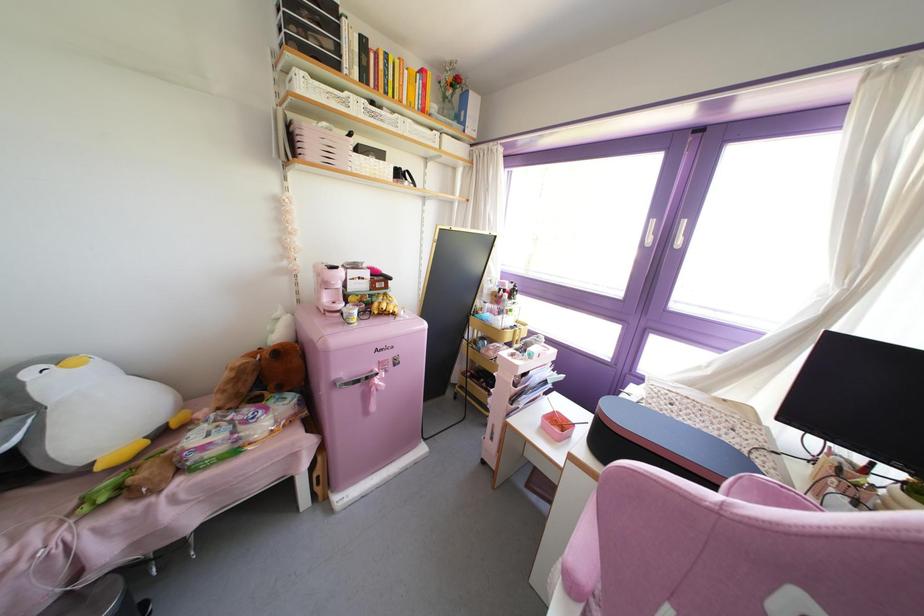
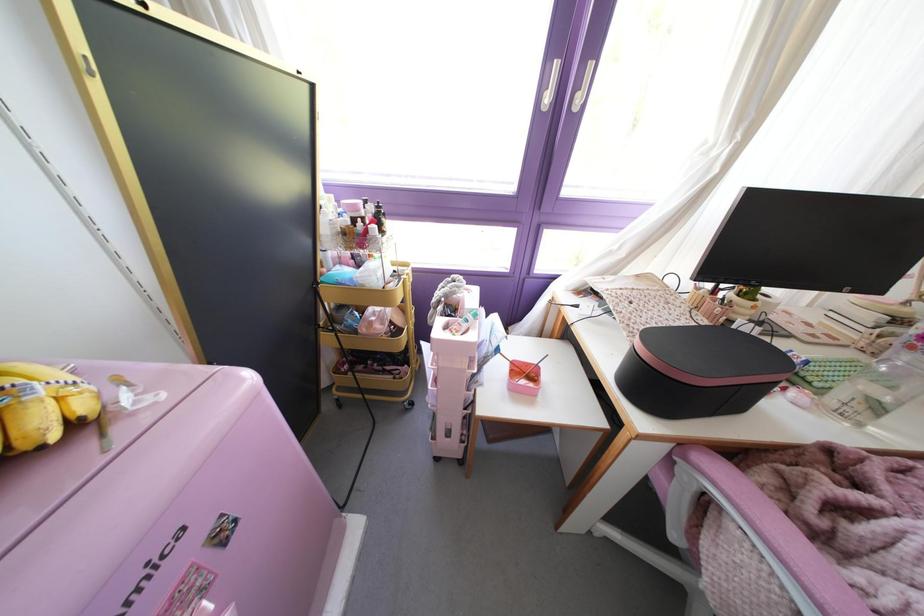
Based on the continuous images, in which direction is the camera rotating?

The camera rotated toward right-down.